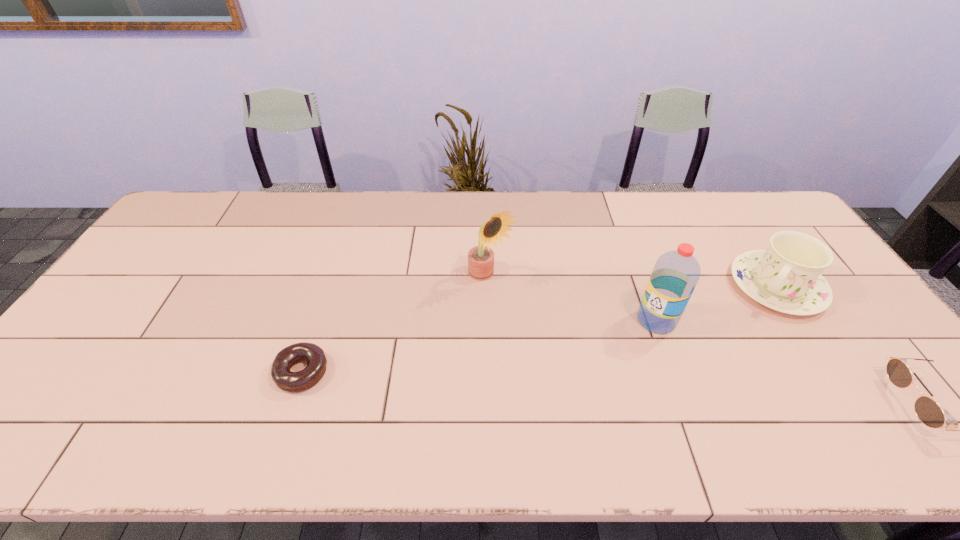
You are a GUI agent. You are given a task and a screenshot of the screen. Output one action in this format:
    pyautogui.click(x=<x>, y=<y>)
    Task: Click on the vacant space on the desktop that is between the shortest object and the fourth tallest object and is positioned on the handle side of the chinaware
    The width and height of the screenshot is (960, 540).
    Given the screenshot: What is the action you would take?
    pyautogui.click(x=700, y=393)

The height and width of the screenshot is (540, 960). In order to click on vacant spot on the desktop that is between the doughnut and the sunglasses and is positioned on the face of the fourth object from right to left in this screenshot , I will do `click(612, 388)`.

Identify the location of vacant space on the desktop that is between the doughnut and the second shortest object and is positioned on the front label of the third object from right to left. (543, 384).